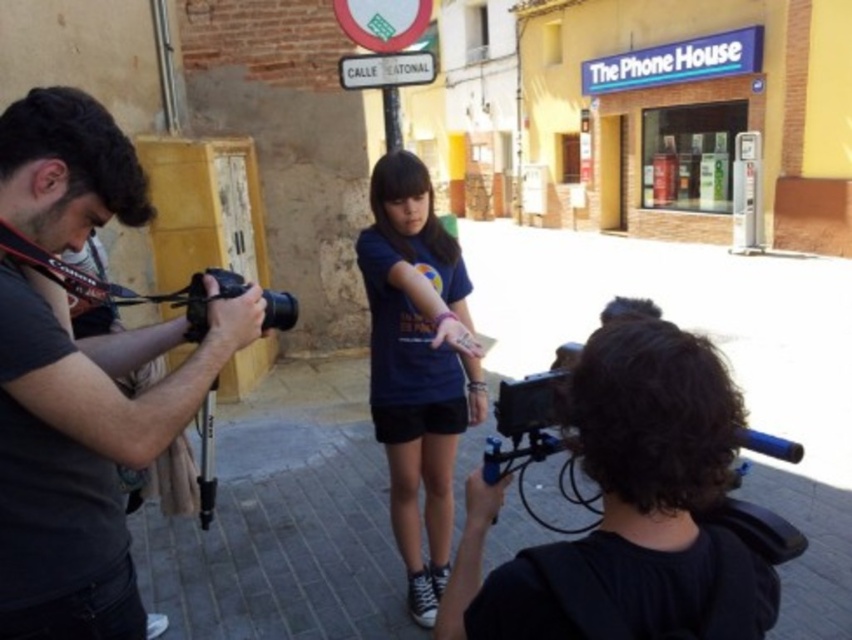
Question: Is dark gray shirt at left positioned before white plastic street sign at upper center?

Choices:
 (A) yes
 (B) no

Answer: (A)

Question: Which is farther from the dark gray shirt at left?

Choices:
 (A) black plastic camera at left
 (B) white plastic street sign at upper center
 (C) matte blue t-shirt at center

Answer: (B)

Question: Observing the image, what is the correct spatial positioning of dark gray shirt at left in reference to white plastic street sign at upper center?

Choices:
 (A) below
 (B) above

Answer: (A)

Question: Considering the real-world distances, which object is closest to the dark gray shirt at left?

Choices:
 (A) matte blue t-shirt at center
 (B) black plastic camera at left
 (C) white plastic street sign at upper center

Answer: (B)

Question: Estimate the real-world distances between objects in this image. Which object is farther from the black plastic camera at left?

Choices:
 (A) dark gray shirt at left
 (B) matte blue t-shirt at center
 (C) white plastic street sign at upper center

Answer: (C)

Question: Is black plastic camera at left bigger than white plastic street sign at upper center?

Choices:
 (A) no
 (B) yes

Answer: (A)